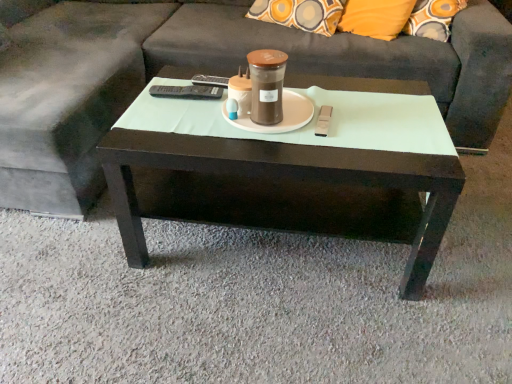
Question: From the image's perspective, does dark gray fabric couch at center appear lower than dark wood coffee table at center?

Choices:
 (A) yes
 (B) no

Answer: (B)

Question: Is dark gray fabric couch at center taller than dark wood coffee table at center?

Choices:
 (A) no
 (B) yes

Answer: (B)

Question: Is dark gray fabric couch at center facing towards dark wood coffee table at center?

Choices:
 (A) no
 (B) yes

Answer: (B)

Question: From a real-world perspective, is dark gray fabric couch at center physically below dark wood coffee table at center?

Choices:
 (A) yes
 (B) no

Answer: (B)

Question: Considering the relative sizes of dark gray fabric couch at center and dark wood coffee table at center in the image provided, is dark gray fabric couch at center thinner than dark wood coffee table at center?

Choices:
 (A) no
 (B) yes

Answer: (A)

Question: From a real-world perspective, is dark wood coffee table at center above or below white matte saucer at center?

Choices:
 (A) above
 (B) below

Answer: (B)

Question: Looking at their shapes, would you say dark wood coffee table at center is wider or thinner than white matte saucer at center?

Choices:
 (A) thin
 (B) wide

Answer: (B)

Question: From their relative heights in the image, would you say dark wood coffee table at center is taller or shorter than white matte saucer at center?

Choices:
 (A) short
 (B) tall

Answer: (B)

Question: Is dark wood coffee table at center to the left or to the right of white matte saucer at center in the image?

Choices:
 (A) left
 (B) right

Answer: (B)

Question: From the image's perspective, is dark gray fabric couch at center above or below brown matte jar at center?

Choices:
 (A) below
 (B) above

Answer: (B)

Question: In the image, is dark gray fabric couch at center positioned in front of or behind brown matte jar at center?

Choices:
 (A) front
 (B) behind

Answer: (A)

Question: Is dark gray fabric couch at center bigger or smaller than brown matte jar at center?

Choices:
 (A) big
 (B) small

Answer: (A)

Question: Considering the positions of dark gray fabric couch at center and brown matte jar at center in the image, is dark gray fabric couch at center taller or shorter than brown matte jar at center?

Choices:
 (A) short
 (B) tall

Answer: (B)

Question: From the image's perspective, relative to dark gray fabric couch at center, is dark wood coffee table at center above or below?

Choices:
 (A) below
 (B) above

Answer: (A)

Question: Considering the relative positions of dark wood coffee table at center and dark gray fabric couch at center in the image provided, is dark wood coffee table at center to the left or to the right of dark gray fabric couch at center?

Choices:
 (A) left
 (B) right

Answer: (B)